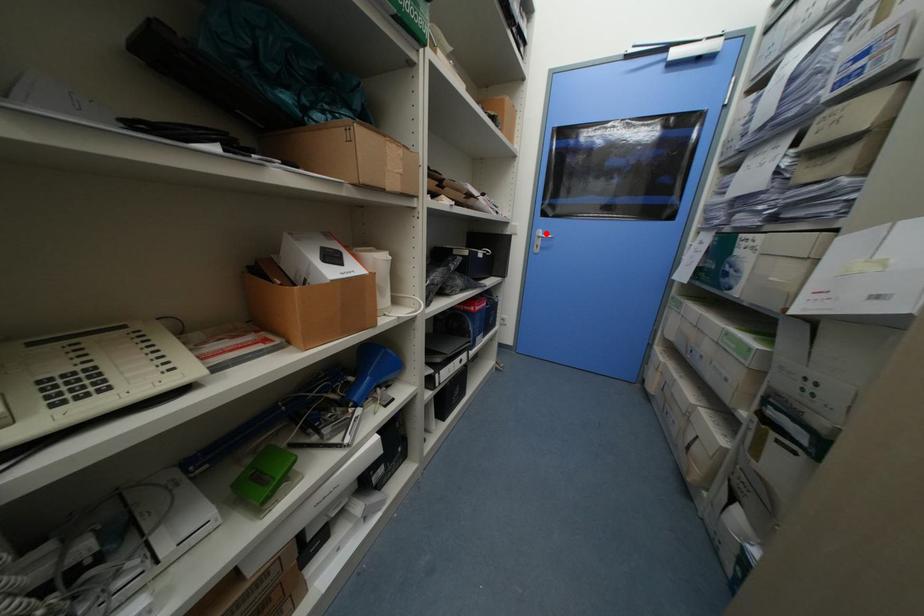
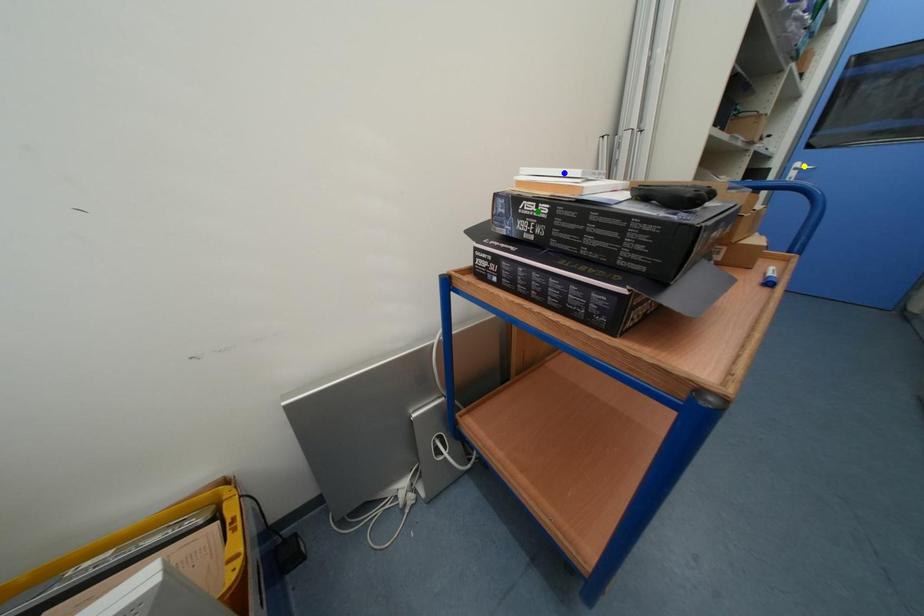
Question: I am providing you with two images of the same scene from different viewpoints. A red point is marked on the first image. You are given multiple points on the second image. Which point in image 2 represents the same 3d spot as the red point in image 1?

Choices:
 (A) yellow point
 (B) blue point
 (C) green point

Answer: (A)